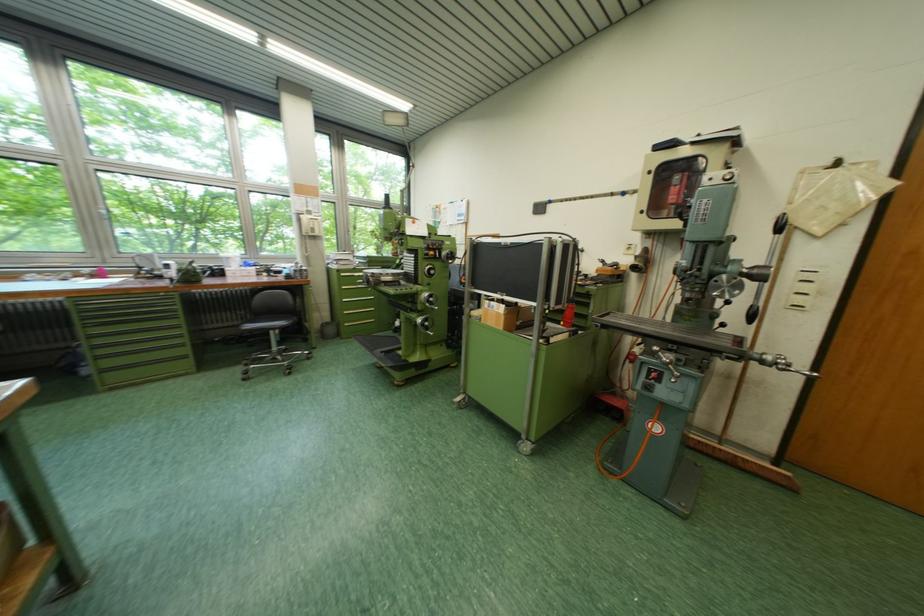
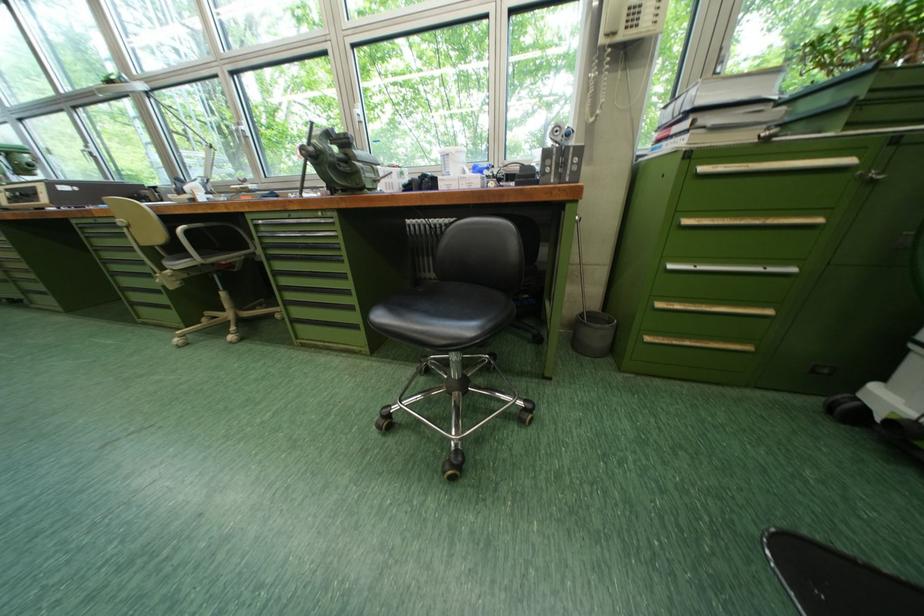
Find the pixel in the second image that matches (x=355, y=290) in the first image.

(698, 224)